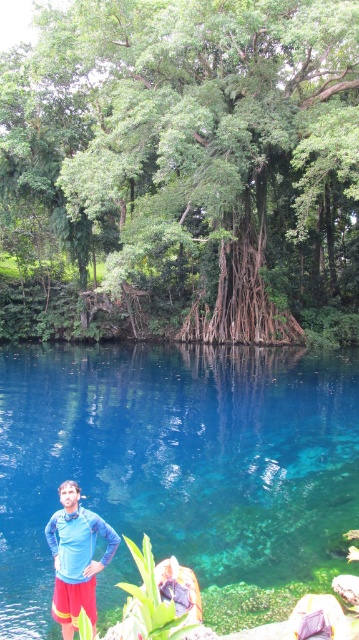
Question: Does transparent blue water at center appear over blue fabric shirt at lower left?

Choices:
 (A) yes
 (B) no

Answer: (B)

Question: Which point is closer to the camera taking this photo?

Choices:
 (A) (313, 376)
 (B) (90, 67)

Answer: (A)

Question: Can you confirm if transparent blue water at center is smaller than blue fabric shirt at lower left?

Choices:
 (A) yes
 (B) no

Answer: (B)

Question: Can you confirm if green leafy tree at center is positioned above blue fabric shirt at lower left?

Choices:
 (A) no
 (B) yes

Answer: (B)

Question: Which point is farther from the camera taking this photo?

Choices:
 (A) (48, 532)
 (B) (11, 592)
 (C) (348, 282)

Answer: (C)

Question: Which object appears closest to the camera in this image?

Choices:
 (A) blue fabric shirt at lower left
 (B) transparent blue water at center
 (C) green leafy tree at center

Answer: (A)